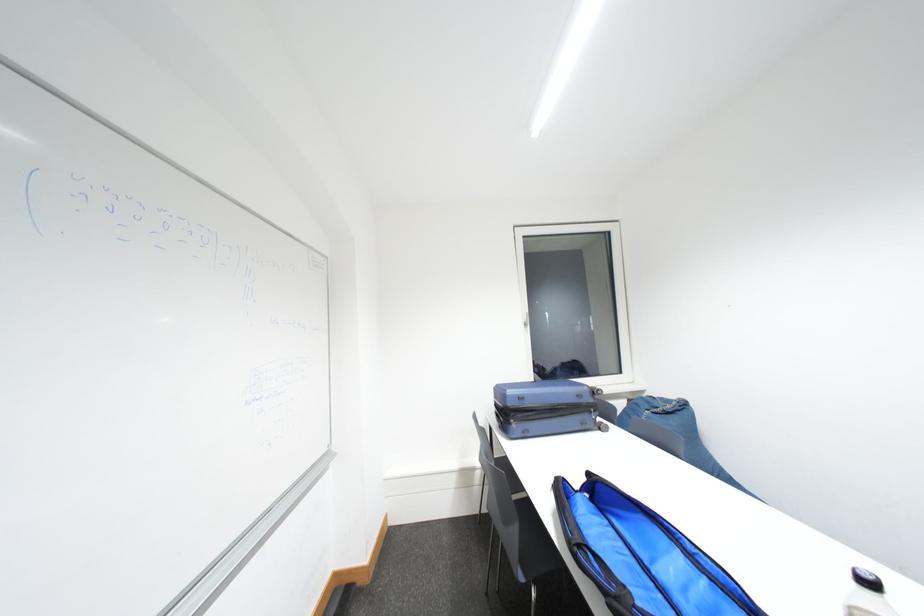
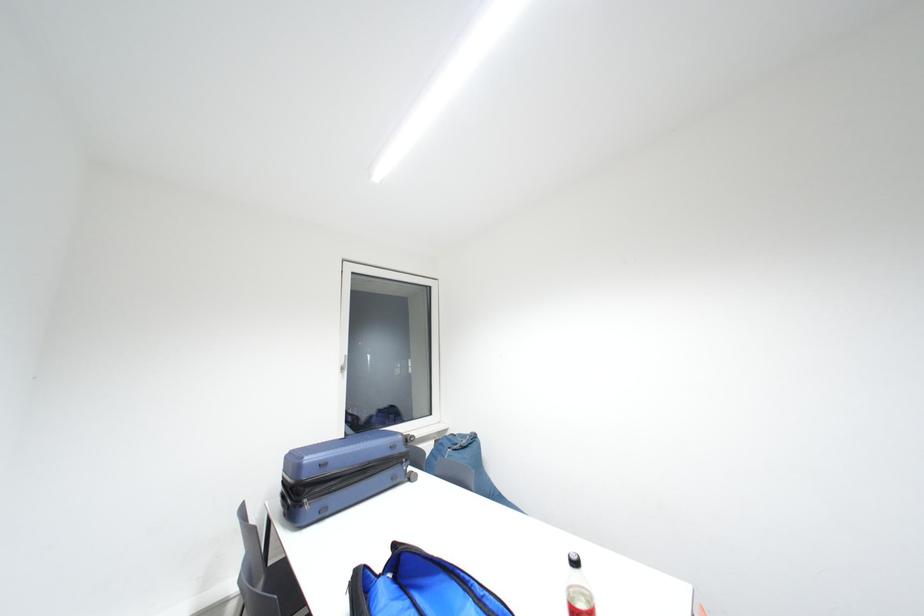
Question: The camera is either moving clockwise (left) or counter-clockwise (right) around the object. The first image is from the beginning of the video and the second image is from the end. Is the camera moving left or right when shooting the video?

Choices:
 (A) Left
 (B) Right

Answer: (A)